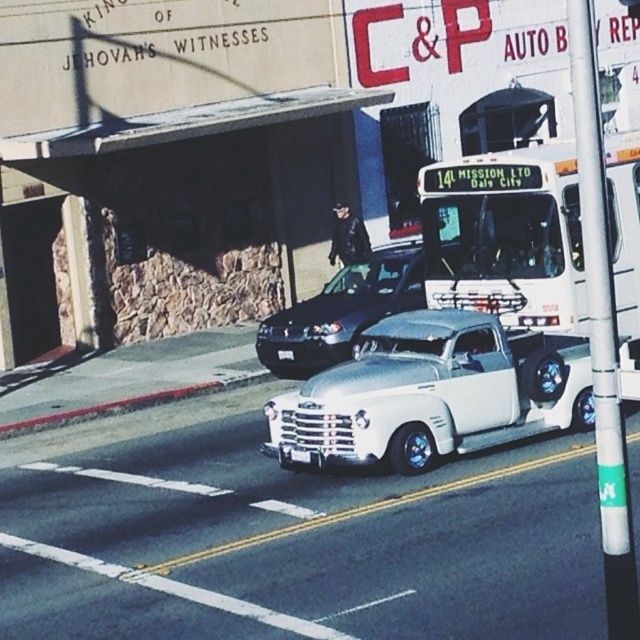
Between white metallic truck at center and white matte bus at upper center, which one is positioned lower?

white metallic truck at center

Can you confirm if white metallic truck at center is shorter than white matte bus at upper center?

Yes, white metallic truck at center is shorter than white matte bus at upper center.

Is point (410, 353) closer to viewer compared to point (609, 184)?

That is True.

Locate an element on the screen. white metallic truck at center is located at coordinates (433, 394).

Can you confirm if white matte bus at upper center is shorter than shiny black sedan at center?

Incorrect, white matte bus at upper center's height does not fall short of shiny black sedan at center's.

Is white matte bus at upper center smaller than shiny black sedan at center?

Yes.

The image size is (640, 640). I want to click on white matte bus at upper center, so click(506, 236).

Is white metallic truck at center below shiny black sedan at center?

Correct, white metallic truck at center is located below shiny black sedan at center.

Between white metallic truck at center and shiny black sedan at center, which one is positioned higher?

shiny black sedan at center is higher up.

Which is in front, point (371, 394) or point (355, 308)?

Point (371, 394)

This screenshot has width=640, height=640. What are the coordinates of `white metallic truck at center` in the screenshot? It's located at (433, 394).